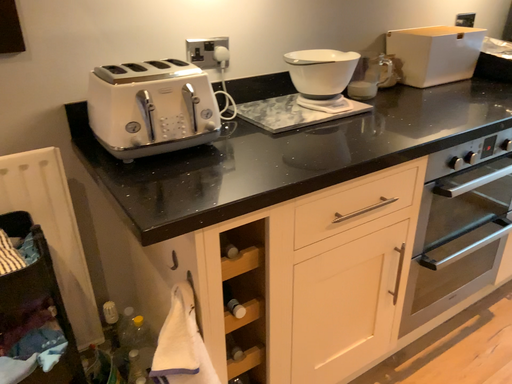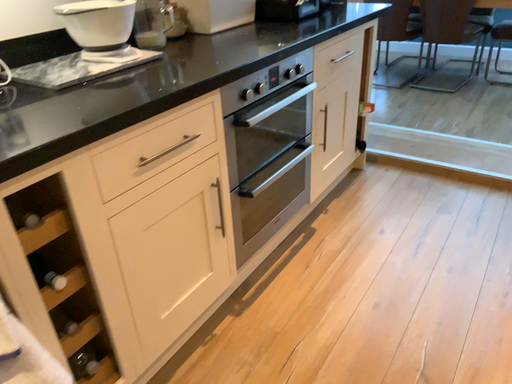
Question: Which way did the camera rotate in the video?

Choices:
 (A) rotated left
 (B) rotated right

Answer: (B)